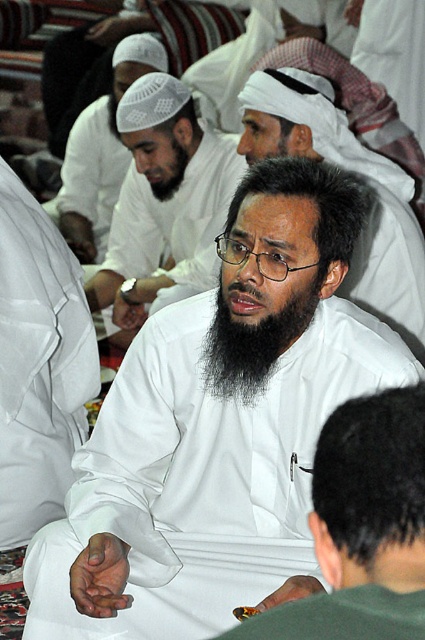
Question: Which point is closer to the camera taking this photo?

Choices:
 (A) (416, 580)
 (B) (365, 220)

Answer: (A)

Question: Is white matte shirt at center closer to camera compared to white matte robe at center?

Choices:
 (A) yes
 (B) no

Answer: (A)

Question: Based on their relative distances, which object is nearer to the white matte/soft fabric at center?

Choices:
 (A) white matte robe at center
 (B) white matte/soft headscarf at center

Answer: (B)

Question: Does white matte/soft fabric at center appear on the left side of white matte headscarf at upper center?

Choices:
 (A) yes
 (B) no

Answer: (B)

Question: Is white matte headscarf at upper center to the left of black matte beard at center from the viewer's perspective?

Choices:
 (A) yes
 (B) no

Answer: (A)

Question: Estimate the real-world distances between objects in this image. Which object is farther from the white matte/soft headscarf at center?

Choices:
 (A) white matte headscarf at upper center
 (B) white matte clothing at center
 (C) white matte robe at center
 (D) black matte beard at center

Answer: (A)